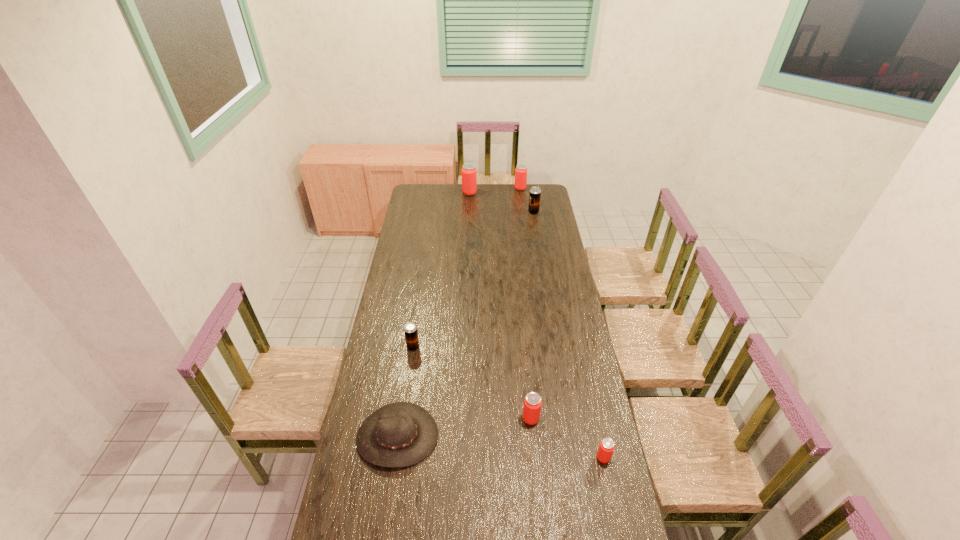
At what (x,y) coordinates should I click in order to perform the action: click on the leftmost red beer can. Please return your answer as a coordinate pair (x, y). Image resolution: width=960 pixels, height=540 pixels. Looking at the image, I should click on (469, 172).

Identify the location of the tallest object. (469, 172).

You are a GUI agent. You are given a task and a screenshot of the screen. Output one action in this format:
    pyautogui.click(x=<x>, y=<y>)
    Task: Click on the second biggest red beer can
    The image size is (960, 540).
    Given the screenshot: What is the action you would take?
    pyautogui.click(x=521, y=170)

Where is `the third farthest object`? the third farthest object is located at coordinates (535, 193).

Where is `the bigger black beer can`? The width and height of the screenshot is (960, 540). the bigger black beer can is located at coordinates (535, 193).

Locate an element on the screen. This screenshot has height=540, width=960. the smaller black beer can is located at coordinates (411, 335).

In order to click on the nearer black beer can in this screenshot , I will do `click(411, 335)`.

At what (x,y) coordinates should I click in order to perform the action: click on the second nearest beer can. Please return your answer as a coordinate pair (x, y). This screenshot has width=960, height=540. Looking at the image, I should click on (532, 403).

Locate an element on the screen. the second smallest red beer can is located at coordinates (532, 403).

Locate an element on the screen. The width and height of the screenshot is (960, 540). gray hat is located at coordinates (401, 434).